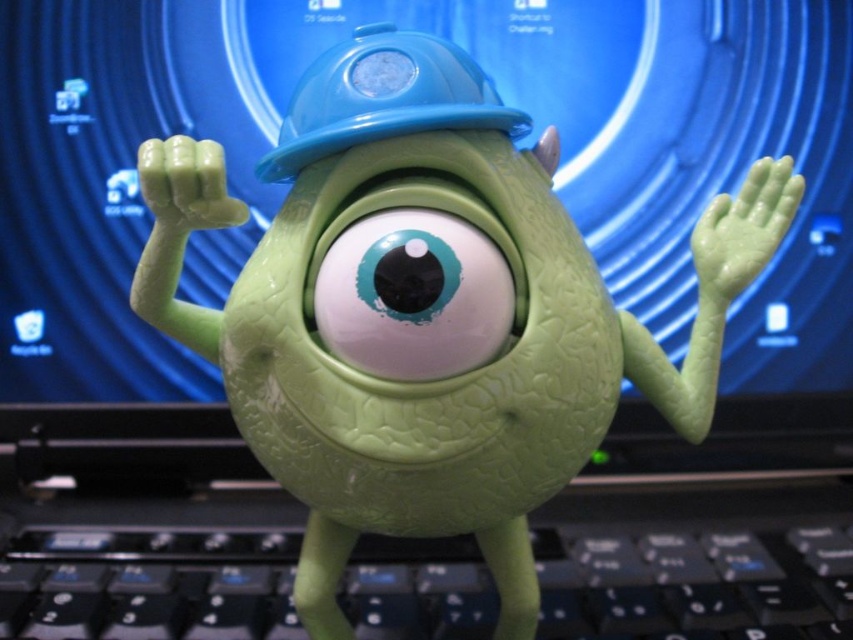
You are a toy designer inspecting the Mike Wazowski toy. You notice the matte green eye at center and the blue hard hat at center. Which object is closer to you when looking at the toy?

The matte green eye at center is closer to you because it is positioned in front of the blue hard hat at center.

You are a person with a 12 inch ruler. You want to measure the distance between the black plastic keyboard at center and the camera. How many rulers would you need to place end to end to reach that distance?

The distance between the black plastic keyboard at center and the camera is 36.70 inches. Since each ruler is 12 inches long, you would need 3 rulers placed end to end to cover the distance because 3 rulers multiplied by 12 inches equals 36 inches, which is just short of the required distance. However, since you can only use whole rulers, you would need 4 rulers to fully cover the 36.70 inches.